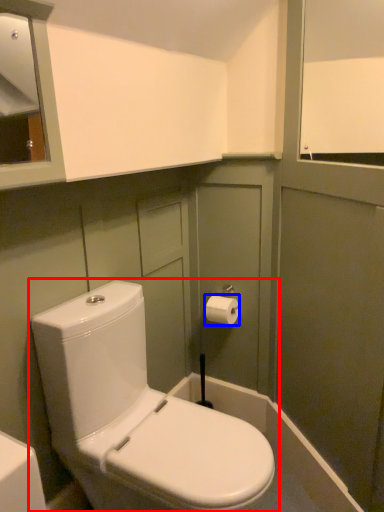
Question: Which object appears farthest to the camera in this image, toilet (highlighted by a red box) or toiletry (highlighted by a blue box)?

Choices:
 (A) toilet
 (B) toiletry

Answer: (B)